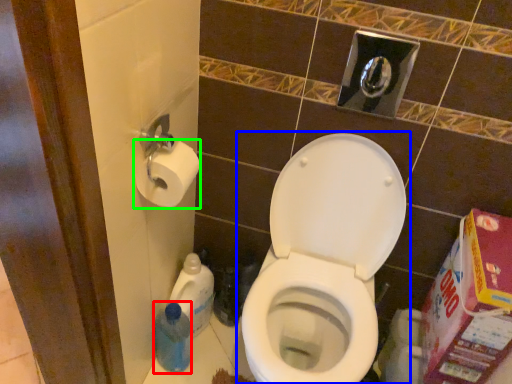
Question: Which object is positioned closest to cleaning product (highlighted by a red box)? Select from toilet (highlighted by a blue box) and toilet paper (highlighted by a green box).

Choices:
 (A) toilet
 (B) toilet paper

Answer: (A)